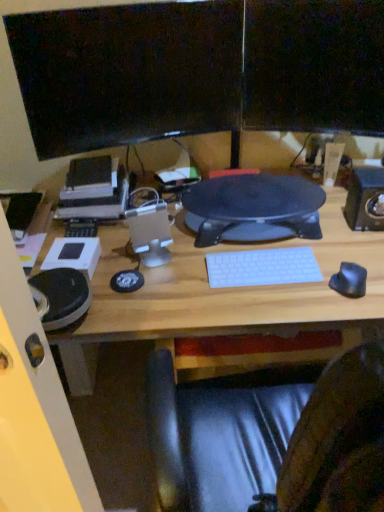
Question: From a real-world perspective, relative to black plastic speaker at right, marked as the 2th speaker in a left-to-right arrangement, is white plastic keyboard at center vertically above or below?

Choices:
 (A) below
 (B) above

Answer: (A)

Question: Is white plastic keyboard at center in front of or behind black plastic speaker at right, the 1th speaker from the right, in the image?

Choices:
 (A) front
 (B) behind

Answer: (A)

Question: Estimate the real-world distances between objects in this image. Which object is closer to the matte black monitor at upper center, the 1th computer monitor in the right-to-left sequence?

Choices:
 (A) black rubber mouse at right
 (B) black textured mouse pad at center
 (C) satin silver speaker at center, the first speaker viewed from the left
 (D) white plastic keyboard at center
 (E) black plastic speaker at right, marked as the 2th speaker in a left-to-right arrangement

Answer: (B)

Question: Considering the real-world distances, which object is farthest from the black textured mouse pad at center?

Choices:
 (A) satin silver speaker at center, the 2th speaker when ordered from right to left
 (B) black glossy monitor at upper center, which is the first computer monitor from left to right
 (C) white plastic keyboard at center
 (D) black rubber mouse at right
 (E) matte black monitor at upper center, the second computer monitor when ordered from left to right

Answer: (B)